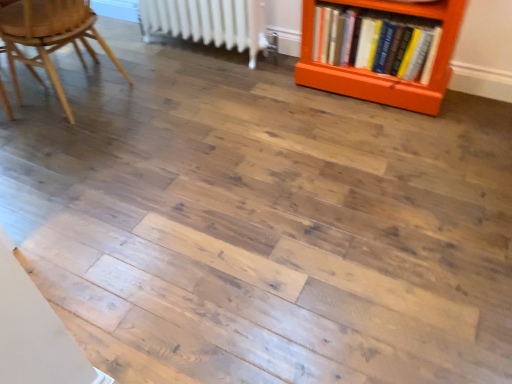
What do you see at coordinates (375, 41) in the screenshot?
I see `hardcover books at right` at bounding box center [375, 41].

What is the approximate width of hardcover books at right?

The width of hardcover books at right is 10.26 inches.

The image size is (512, 384). Identify the location of white metallic radiator at upper center. (208, 22).

Is white metallic radiator at upper center facing away from hardcover books at right?

white metallic radiator at upper center does not have its back to hardcover books at right.

How different are the orientations of white metallic radiator at upper center and hardcover books at right in degrees?

There is a 1.34-degree angle between the facing directions of white metallic radiator at upper center and hardcover books at right.

Who is shorter, white metallic radiator at upper center or hardcover books at right?

hardcover books at right is shorter.

Which object is wider, white metallic radiator at upper center or hardcover books at right?

hardcover books at right is wider.

Considering the positions of objects white metallic radiator at upper center and wooden chair at left in the image provided, who is in front, white metallic radiator at upper center or wooden chair at left?

wooden chair at left is more forward.

The image size is (512, 384). Find the location of `radiator that is above the wooden chair at left (from the image's perspective)`. radiator that is above the wooden chair at left (from the image's perspective) is located at coordinates click(208, 22).

Which of these two, white metallic radiator at upper center or wooden chair at left, is thinner?

With smaller width is white metallic radiator at upper center.

From a real-world perspective, is white metallic radiator at upper center beneath wooden chair at left?

Yes.

Is wooden chair at left located outside hardcover books at right?

wooden chair at left lies outside hardcover books at right's area.

Based on the photo, from the image's perspective, is wooden chair at left below hardcover books at right?

Indeed, from the image's perspective, wooden chair at left is shown beneath hardcover books at right.

Is wooden chair at left taller than hardcover books at right?

Yes.

Is wooden chair at left wider than hardcover books at right?

Yes, wooden chair at left is wider than hardcover books at right.

Consider the image. Is wooden chair at left not near white metallic radiator at upper center?

wooden chair at left is actually quite close to white metallic radiator at upper center.

Between point (90, 24) and point (173, 32), which one is positioned in front?

The point (90, 24) is closer to the camera.

Between wooden chair at left and white metallic radiator at upper center, which one is positioned in front?

wooden chair at left is more forward.

Considering the relative sizes of wooden chair at left and white metallic radiator at upper center in the image provided, is wooden chair at left wider than white metallic radiator at upper center?

Yes, wooden chair at left is wider than white metallic radiator at upper center.

Can you tell me how much hardcover books at right and wooden chair at left differ in facing direction?

90 degrees.

Considering the sizes of objects hardcover books at right and wooden chair at left in the image provided, who is bigger, hardcover books at right or wooden chair at left?

wooden chair at left.

From the image's perspective, between hardcover books at right and wooden chair at left, who is located below?

From the image's view, wooden chair at left is below.

Considering the relative sizes of hardcover books at right and wooden chair at left in the image provided, is hardcover books at right thinner than wooden chair at left?

Correct, the width of hardcover books at right is less than that of wooden chair at left.

Is white metallic radiator at upper center located within hardcover books at right?

No, white metallic radiator at upper center is not a part of hardcover books at right.

Image resolution: width=512 pixels, height=384 pixels. Find the location of `radiator below the hardcover books at right (from a real-world perspective)`. radiator below the hardcover books at right (from a real-world perspective) is located at coordinates (208, 22).

From the picture: From a real-world perspective, is hardcover books at right positioned above or below white metallic radiator at upper center?

In terms of real-world spatial position, hardcover books at right is above white metallic radiator at upper center.

Is hardcover books at right to the left of white metallic radiator at upper center from the viewer's perspective?

Incorrect, hardcover books at right is not on the left side of white metallic radiator at upper center.

In order to click on book in front of the white metallic radiator at upper center in this screenshot , I will do `click(375, 41)`.

Identify the location of chair below the white metallic radiator at upper center (from the image's perspective). (49, 37).

Based on their spatial positions, is white metallic radiator at upper center or wooden chair at left further from hardcover books at right?

wooden chair at left lies further to hardcover books at right than the other object.

Looking at this image, which object lies further to the anchor point white metallic radiator at upper center, hardcover books at right or wooden chair at left?

Based on the image, hardcover books at right appears to be further to white metallic radiator at upper center.

Looking at the image, which one is located closer to white metallic radiator at upper center, wooden chair at left or hardcover books at right?

wooden chair at left lies closer to white metallic radiator at upper center than the other object.

Based on their spatial positions, is white metallic radiator at upper center or hardcover books at right closer to wooden chair at left?

white metallic radiator at upper center is positioned closer to the anchor wooden chair at left.

Estimate the real-world distances between objects in this image. Which object is closer to wooden chair at left, hardcover books at right or white metallic radiator at upper center?

white metallic radiator at upper center is positioned closer to the anchor wooden chair at left.

Looking at the image, which one is located closer to hardcover books at right, wooden chair at left or white metallic radiator at upper center?

white metallic radiator at upper center lies closer to hardcover books at right than the other object.

The height and width of the screenshot is (384, 512). In order to click on radiator located between wooden chair at left and hardcover books at right in the left-right direction in this screenshot , I will do `click(208, 22)`.